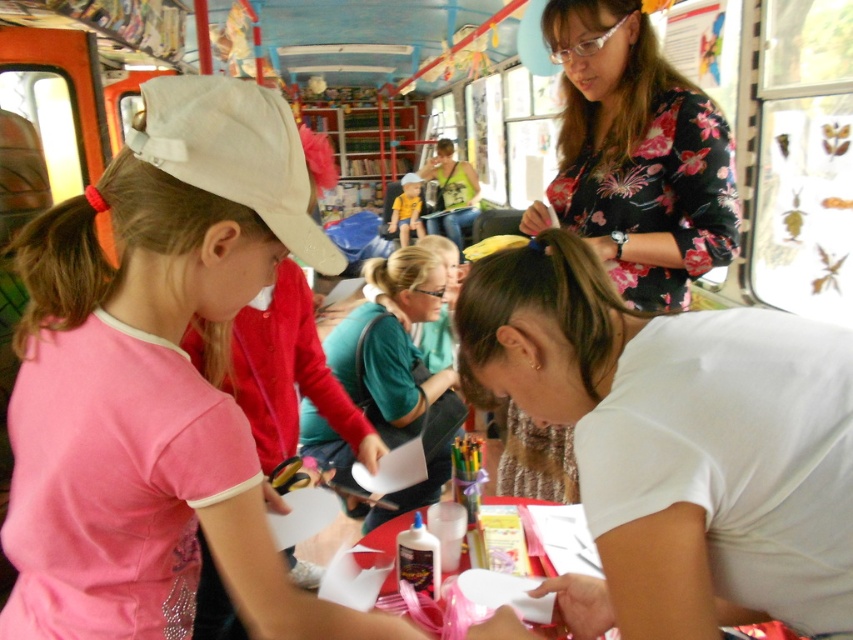
Can you confirm if pink fabric shirt at center is taller than yellow shirt at center?

Incorrect, pink fabric shirt at center's height is not larger of yellow shirt at center's.

Who is more forward, (248, 241) or (404, 234)?

Point (248, 241)

What are the coordinates of `pink fabric shirt at center` in the screenshot? It's located at (157, 381).

Which of these two, green matte shirt at center or matte yellow shirt at center, stands taller?

Standing taller between the two is matte yellow shirt at center.

Does green matte shirt at center lie behind matte yellow shirt at center?

No, green matte shirt at center is in front of matte yellow shirt at center.

You are a GUI agent. You are given a task and a screenshot of the screen. Output one action in this format:
    pyautogui.click(x=<x>, y=<y>)
    Task: Click on the green matte shirt at center
    
    Given the screenshot: What is the action you would take?
    pyautogui.click(x=384, y=371)

You are a GUI agent. You are given a task and a screenshot of the screen. Output one action in this format:
    pyautogui.click(x=<x>, y=<y>)
    Task: Click on the green matte shirt at center
    Image resolution: width=853 pixels, height=640 pixels.
    Given the screenshot: What is the action you would take?
    pyautogui.click(x=384, y=371)

Can you confirm if white matte shirt at lower right is positioned to the right of matte yellow shirt at center?

Indeed, white matte shirt at lower right is positioned on the right side of matte yellow shirt at center.

You are a GUI agent. You are given a task and a screenshot of the screen. Output one action in this format:
    pyautogui.click(x=<x>, y=<y>)
    Task: Click on the white matte shirt at lower right
    
    Given the screenshot: What is the action you would take?
    pyautogui.click(x=677, y=444)

What are the coordinates of `white matte shirt at lower right` in the screenshot? It's located at (677, 444).